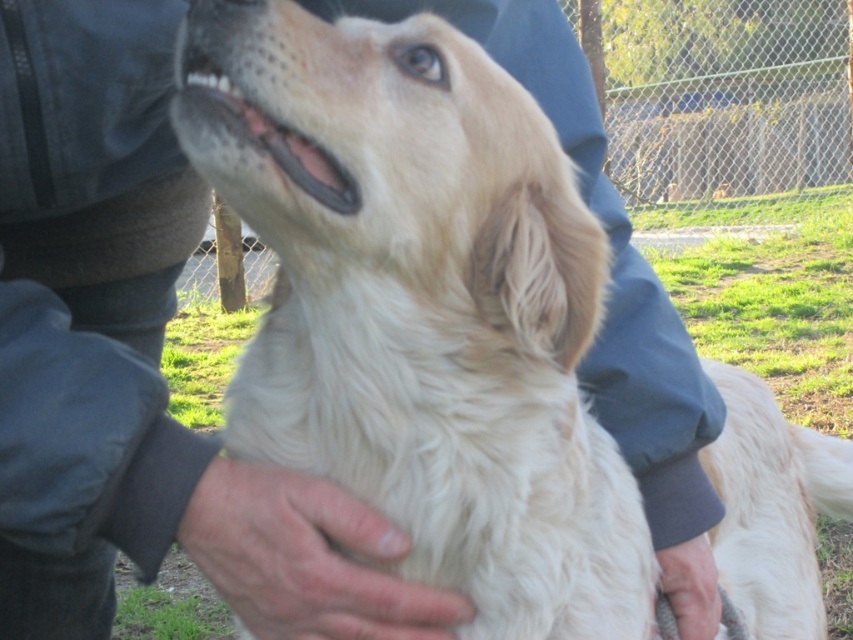
Does fuzzy skin at center have a smaller size compared to smooth skin hand at lower center?

Incorrect, fuzzy skin at center is not smaller in size than smooth skin hand at lower center.

Is fuzzy skin at center taller than smooth skin hand at lower center?

Correct, fuzzy skin at center is much taller as smooth skin hand at lower center.

Is point (225, 582) in front of point (677, 588)?

Yes, it is.

Locate an element on the screen. The width and height of the screenshot is (853, 640). fuzzy skin at center is located at coordinates (305, 557).